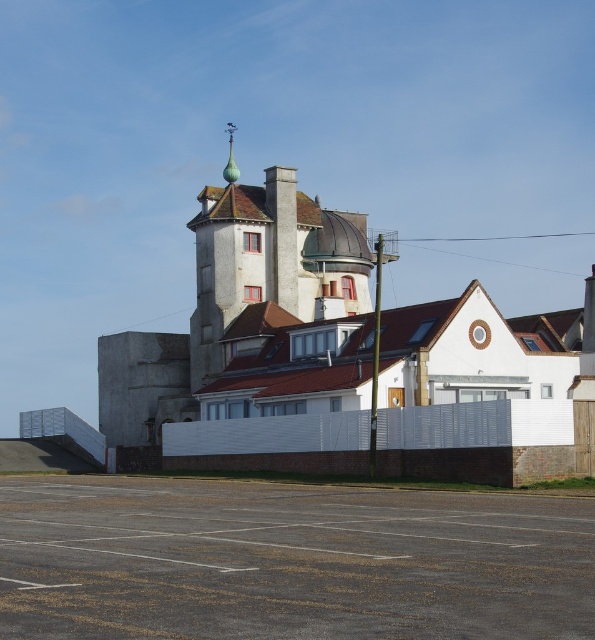
From the picture: Measure the distance between gray asphalt parking lot at lower center and camera.

gray asphalt parking lot at lower center is 18.81 meters away from camera.

Who is taller, gray asphalt parking lot at lower center or smooth gray tower at center?

smooth gray tower at center is taller.

Locate an element on the screen. The height and width of the screenshot is (640, 595). gray asphalt parking lot at lower center is located at coordinates (289, 561).

Based on the photo, does gray asphalt parking lot at lower center appear on the right side of green glazed tile spire at upper center?

Indeed, gray asphalt parking lot at lower center is positioned on the right side of green glazed tile spire at upper center.

Is point (562, 604) more distant than point (228, 180)?

No, (562, 604) is closer to viewer.

Where is `gray asphalt parking lot at lower center`? The height and width of the screenshot is (640, 595). gray asphalt parking lot at lower center is located at coordinates (289, 561).

Does smooth gray tower at center have a lesser width compared to green glazed tile spire at upper center?

No.

Is smooth gray tower at center to the left of green glazed tile spire at upper center from the viewer's perspective?

In fact, smooth gray tower at center is to the right of green glazed tile spire at upper center.

What are the coordinates of `smooth gray tower at center` in the screenshot? It's located at (271, 262).